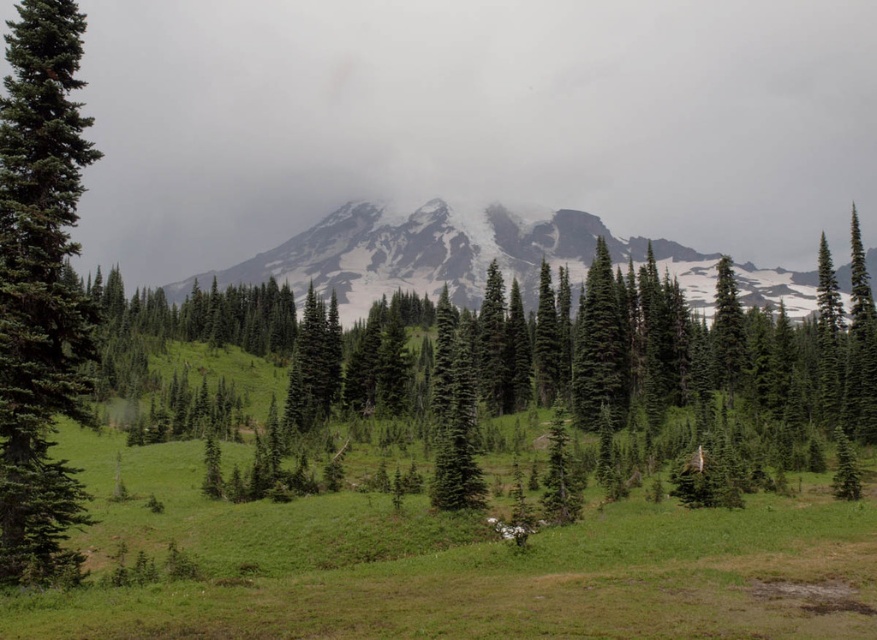
Between green matte tree at center and green matte tree at left, which one appears on the right side from the viewer's perspective?

Positioned to the right is green matte tree at center.

From the picture: Can you confirm if green matte tree at center is bigger than green matte tree at left?

Correct, green matte tree at center is larger in size than green matte tree at left.

At what (x,y) coordinates should I click in order to perform the action: click on green matte tree at center. Please return your answer as a coordinate pair (x, y). The image size is (877, 640). Looking at the image, I should click on (535, 371).

Which of these two, green matte tree at center or snowy granite mountain at center, stands taller?

green matte tree at center is taller.

Can you confirm if green matte tree at center is positioned to the right of snowy granite mountain at center?

Correct, you'll find green matte tree at center to the right of snowy granite mountain at center.

This screenshot has height=640, width=877. What are the coordinates of `green matte tree at center` in the screenshot? It's located at (535, 371).

Which is behind, point (11, 355) or point (582, 257)?

Point (582, 257)

Who is lower down, green matte tree at left or snowy granite mountain at center?

green matte tree at left is below.

Is point (76, 492) positioned before point (498, 253)?

Yes, it is in front of point (498, 253).

Find the location of a particular element. This screenshot has height=640, width=877. green matte tree at left is located at coordinates (40, 289).